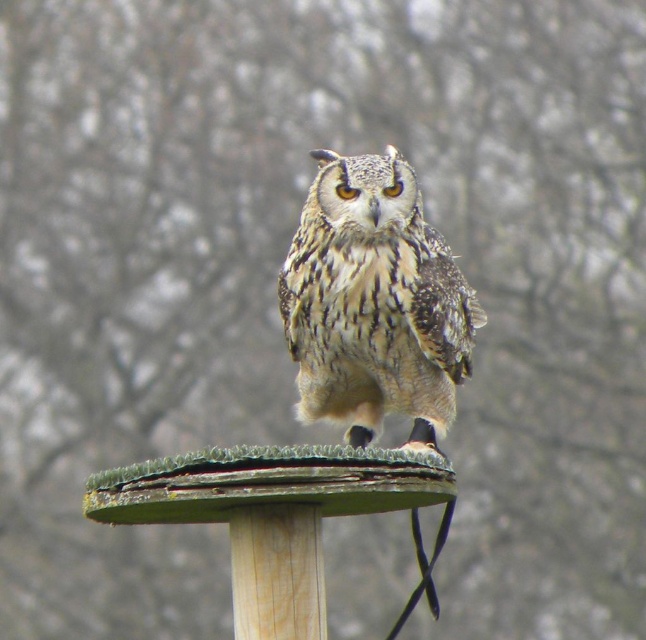
You are a photographer trying to capture the owl in the image. The owl is at point (373, 301). Where should you aim your camera to ensure the owl is in the center of the photo?

The speckled feathered owl at center is located at point (373, 301), so you should aim your camera at that coordinate to center the owl in the photo.

You are a birdwatcher observing the speckled feathered owl at center and the wooden post at center. Which object is taller?

The speckled feathered owl at center is taller than the wooden post at center.

You are an owl photographer aiming to capture the owl from the front. You notice two points in the scene labeled as point (439,435) and point (267,545). Which point is closer to your camera lens?

Point (439,435) is further to the viewer than point (267,545), so the point closer to the camera lens is point (267,545).